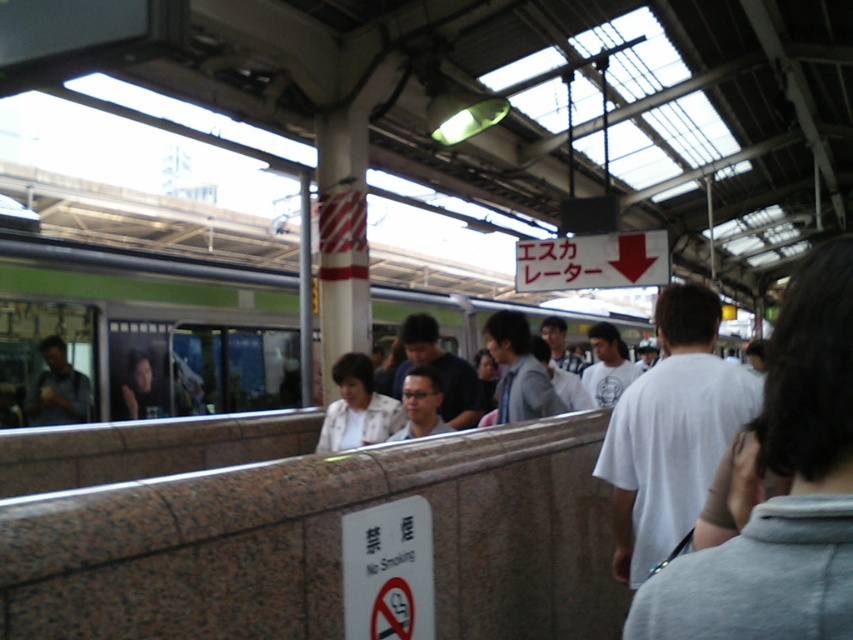
Question: Does green metallic train at center have a larger size compared to white textured jacket at center?

Choices:
 (A) yes
 (B) no

Answer: (A)

Question: Does green metallic train at center appear over light gray shirt at center?

Choices:
 (A) no
 (B) yes

Answer: (B)

Question: Which point is closer to the camera?

Choices:
 (A) green metallic train at center
 (B) light gray shirt at center
 (C) white textured jacket at center

Answer: (B)

Question: Is the position of green metallic train at center more distant than that of white textured jacket at center?

Choices:
 (A) yes
 (B) no

Answer: (A)

Question: Which of the following is the closest to the observer?

Choices:
 (A) (247, 248)
 (B) (350, 445)

Answer: (B)

Question: Considering the real-world distances, which object is farthest from the white textured jacket at center?

Choices:
 (A) green metallic train at center
 (B) light gray shirt at center

Answer: (A)